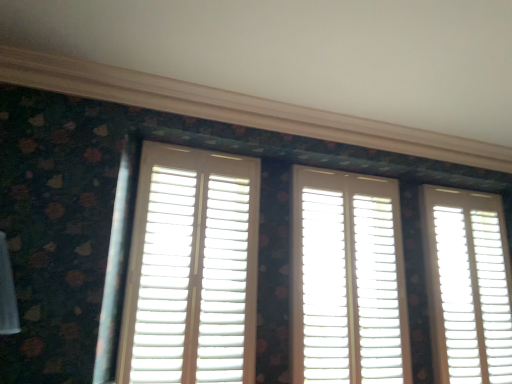
Question: Can we say white matte shutter at right, acting as the 3th window starting from the left, lies outside white matte shutters at center, which is the third window in right-to-left order?

Choices:
 (A) yes
 (B) no

Answer: (A)

Question: From the image's perspective, does white matte shutter at right, acting as the 3th window starting from the left, appear lower than white matte shutters at center, which is the third window in right-to-left order?

Choices:
 (A) yes
 (B) no

Answer: (A)

Question: Does white matte shutter at right, acting as the 3th window starting from the left, have a lesser height compared to white matte shutters at center, marked as the first window in a left-to-right arrangement?

Choices:
 (A) yes
 (B) no

Answer: (B)

Question: From a real-world perspective, is white matte shutter at right, acting as the 3th window starting from the left, on white matte shutters at center, which is the third window in right-to-left order?

Choices:
 (A) yes
 (B) no

Answer: (B)

Question: Does white matte shutter at right, the first window positioned from the right, have a greater width compared to white matte shutters at center, marked as the first window in a left-to-right arrangement?

Choices:
 (A) yes
 (B) no

Answer: (A)

Question: From a real-world perspective, is white matte shutters at center, marked as the first window in a left-to-right arrangement, positioned above or below white matte shutter at right, acting as the 3th window starting from the left?

Choices:
 (A) above
 (B) below

Answer: (A)

Question: Is point (148, 297) positioned closer to the camera than point (466, 205)?

Choices:
 (A) closer
 (B) farther

Answer: (A)

Question: In terms of width, does white matte shutters at center, which is the third window in right-to-left order, look wider or thinner when compared to white matte shutter at right, the first window positioned from the right?

Choices:
 (A) thin
 (B) wide

Answer: (A)

Question: From the image's perspective, relative to white matte shutter at right, acting as the 3th window starting from the left, is white matte shutters at center, which is the third window in right-to-left order, above or below?

Choices:
 (A) above
 (B) below

Answer: (A)

Question: Considering the relative positions of white matte shutters at center, marked as the first window in a left-to-right arrangement, and white wood shutters at center, the 2th window in the left-to-right sequence, in the image provided, is white matte shutters at center, marked as the first window in a left-to-right arrangement, to the left or to the right of white wood shutters at center, the 2th window in the left-to-right sequence,?

Choices:
 (A) left
 (B) right

Answer: (A)

Question: Considering the positions of point (159, 246) and point (354, 350), is point (159, 246) closer or farther from the camera than point (354, 350)?

Choices:
 (A) closer
 (B) farther

Answer: (A)

Question: Considering their positions, is white matte shutters at center, marked as the first window in a left-to-right arrangement, located in front of or behind white wood shutters at center, the 2th window in the left-to-right sequence?

Choices:
 (A) behind
 (B) front

Answer: (B)

Question: Would you say white matte shutters at center, marked as the first window in a left-to-right arrangement, is inside or outside white wood shutters at center, marked as the 2th window in a right-to-left arrangement?

Choices:
 (A) outside
 (B) inside

Answer: (A)

Question: From a real-world perspective, is white wood shutters at center, the 2th window in the left-to-right sequence, positioned above or below white matte shutters at center, marked as the first window in a left-to-right arrangement?

Choices:
 (A) below
 (B) above

Answer: (A)

Question: In the image, is white wood shutters at center, marked as the 2th window in a right-to-left arrangement, positioned in front of or behind white matte shutters at center, which is the third window in right-to-left order?

Choices:
 (A) behind
 (B) front

Answer: (A)